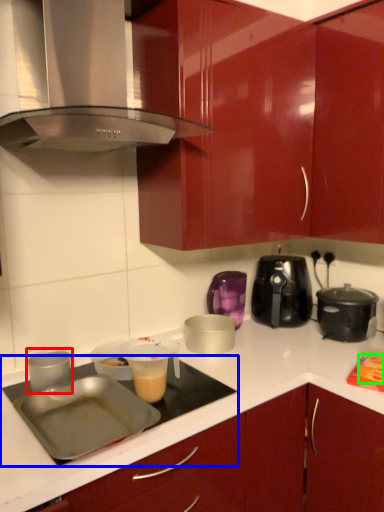
Question: Based on their relative distances, which object is nearer to kitchen appliance (highlighted by a red box)? Choose from gas stove (highlighted by a blue box) and food (highlighted by a green box).

Choices:
 (A) gas stove
 (B) food

Answer: (A)